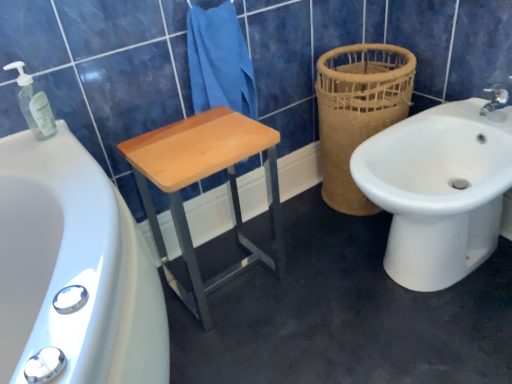
Where is `free area in between white ceramic bidet at right and light wood/matte stool at center`? free area in between white ceramic bidet at right and light wood/matte stool at center is located at coordinates (315, 276).